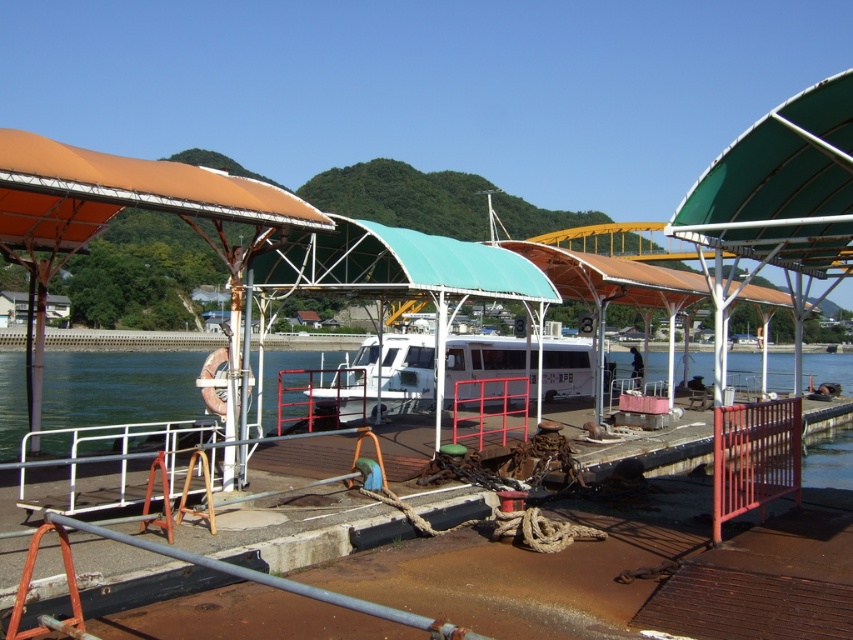
You are standing at the ferry terminal and want to get a clear view of the clear water at lower left. Which direction should you face?

You should face the lower left direction to see the clear water at lower left, as it is located at point coordinates of [120,387].

You are a ferry operator who needs to ensure safe passage for a small dinghy that is 3 meters long. The dinghy must pass between the clear water at lower left and the white matte boat at center. Can the dinghy safely navigate this space?

The clear water at lower left and the white matte boat at center are 26.91 meters apart from each other. Since the dinghy is only 3 meters long, there is sufficient space for it to safely navigate between them.

You are standing on the dock and want to board the white matte boat at center. Can you see the clear water at lower left from your current position?

The clear water at lower left is much taller than the white matte boat at center, so yes, you can see the clear water at lower left from your position on the dock.